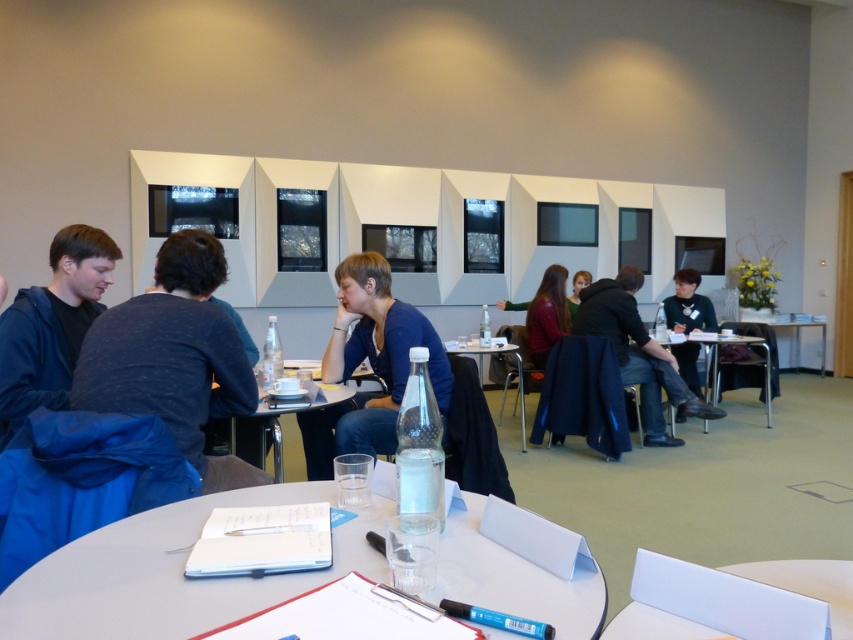
Does white paper at center have a lesser height compared to matte black dress at center?

Indeed, white paper at center has a lesser height compared to matte black dress at center.

Does white paper at center appear under matte black dress at center?

Yes, white paper at center is below matte black dress at center.

Who is more distant from viewer, (712,621) or (558,310)?

The point (558,310) is behind.

The image size is (853, 640). In order to click on white paper at center in this screenshot , I will do (735, 600).

How distant is dark blue sweater at left from wooden table at center?

dark blue sweater at left and wooden table at center are 4.17 meters apart.

Is point (192, 342) positioned in front of point (712, 346)?

Yes, point (192, 342) is in front of point (712, 346).

Where is `dark blue sweater at left`? This screenshot has width=853, height=640. dark blue sweater at left is located at coordinates (173, 356).

Does dark blue jeans at center have a smaller size compared to wooden table at center?

No, dark blue jeans at center is not smaller than wooden table at center.

Which of these two, dark blue jeans at center or wooden table at center, stands shorter?

With less height is wooden table at center.

Between point (676, 355) and point (689, 333), which one is positioned behind?

The point (676, 355) is behind.

Identify the location of dark blue jeans at center. (637, 353).